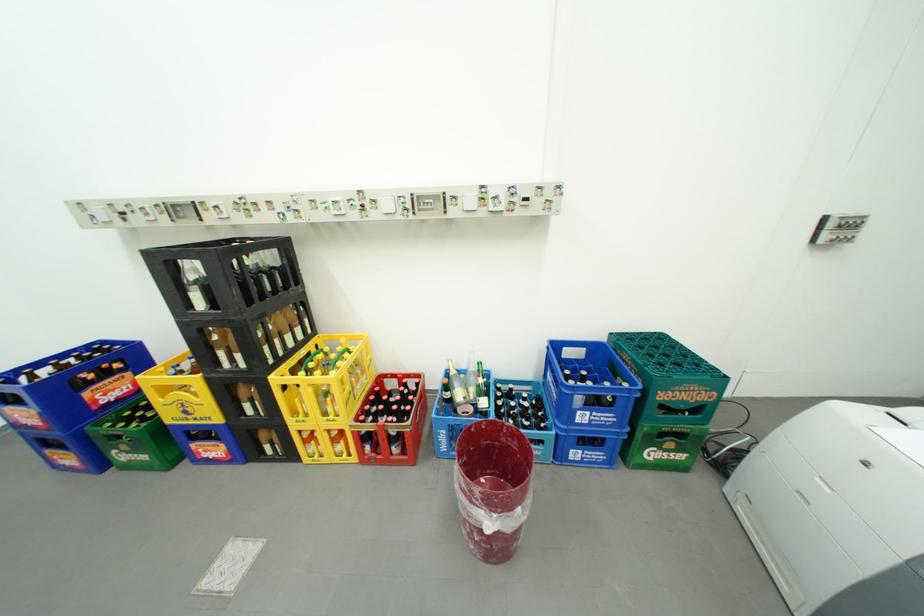
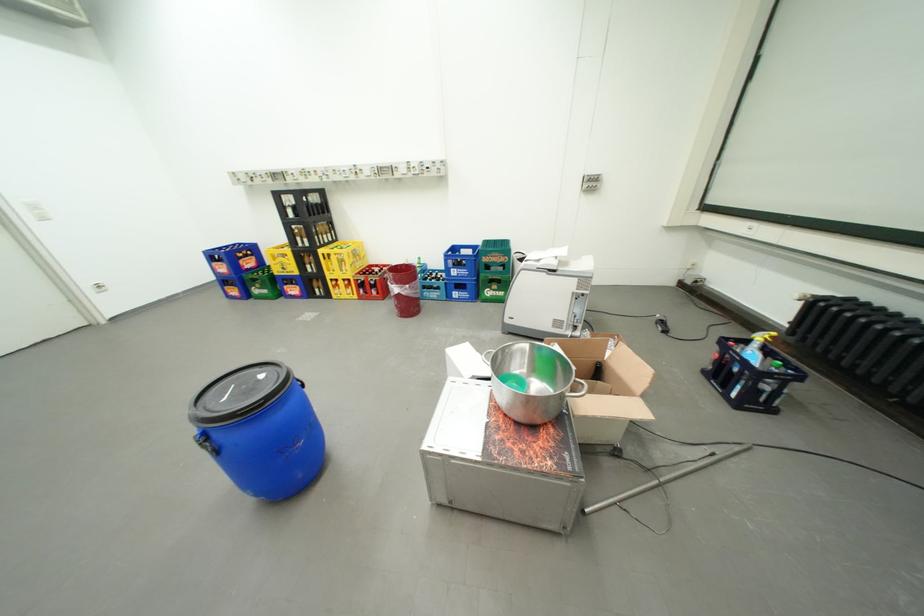
Which direction would the cameraman need to move to produce the second image?

The cameraman moved toward right, backward.